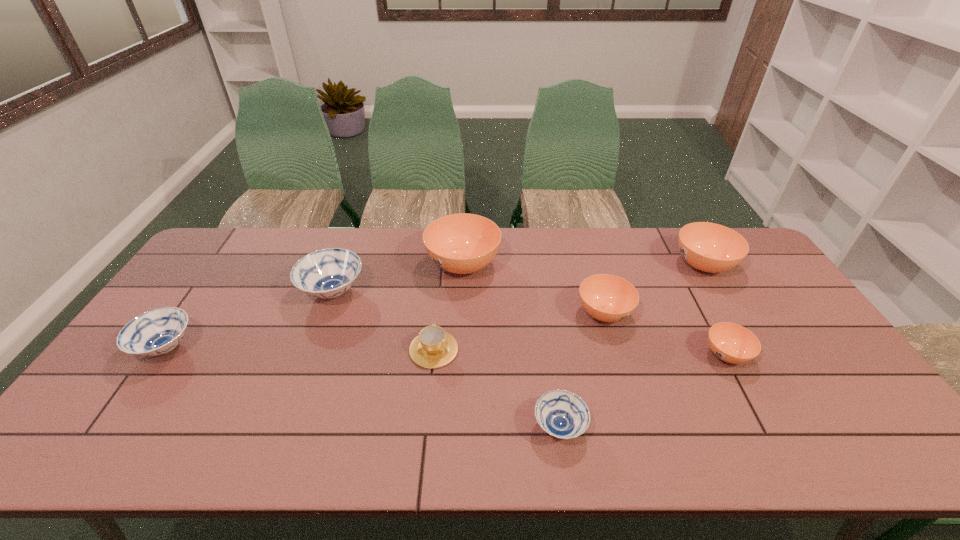
I want to click on free location located with the handle on the side of the cup, so click(x=440, y=295).

Locate an element on the screen. This screenshot has height=540, width=960. free spot located 0.350m with the handle on the side of the cup is located at coordinates (444, 256).

Find the location of `free point located on the back of the smallest blue soup bowl`. free point located on the back of the smallest blue soup bowl is located at coordinates pos(542,313).

In order to click on object positioned at the near edge in this screenshot , I will do `click(560, 413)`.

The height and width of the screenshot is (540, 960). Identify the location of object at the left edge. (156, 332).

Find the location of a particular element. The height and width of the screenshot is (540, 960). object positioned at the right edge is located at coordinates point(709,247).

Locate an element on the screen. This screenshot has height=540, width=960. object that is at the far right corner is located at coordinates (709, 247).

In the image, there is a desktop. What are the coordinates of `vacant space at the far edge` in the screenshot? It's located at (562, 261).

Where is `free space at the near edge of the desktop`? free space at the near edge of the desktop is located at coordinates (807, 456).

In the image, there is a desktop. Identify the location of vacant space at the right edge. The width and height of the screenshot is (960, 540). (795, 340).